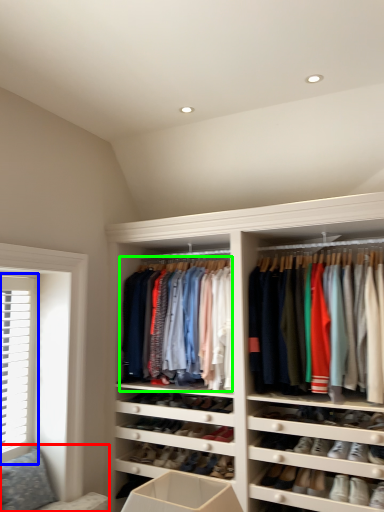
Question: Which object is the farthest from couch (highlighted by a red box)? Choose among these: window (highlighted by a blue box) or clothing (highlighted by a green box).

Choices:
 (A) window
 (B) clothing

Answer: (B)